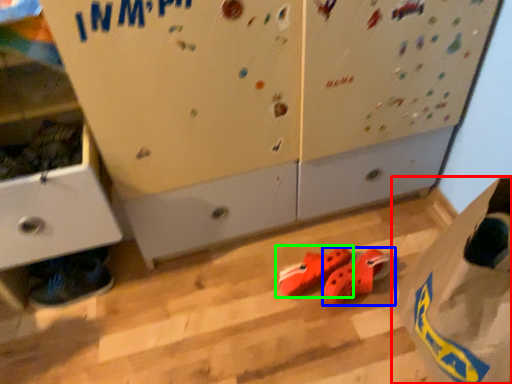
Question: Considering the real-world distances, which object is farthest from paper bag (highlighted by a red box)? footwear (highlighted by a blue box) or footwear (highlighted by a green box)?

Choices:
 (A) footwear
 (B) footwear

Answer: (B)